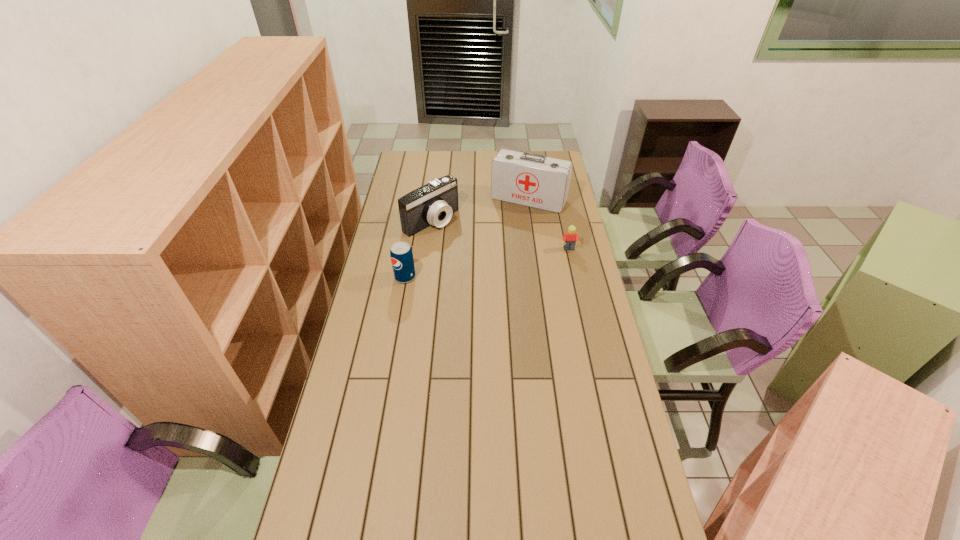
In the image, there is a desktop. Identify the location of vacant region at the right edge. (564, 265).

Identify the location of vacant space at the near right corner of the desktop. The image size is (960, 540). (626, 495).

You are a GUI agent. You are given a task and a screenshot of the screen. Output one action in this format:
    pyautogui.click(x=<x>, y=<y>)
    Task: Click on the free area in between the pop and the third shortest object
    The image size is (960, 540).
    Given the screenshot: What is the action you would take?
    pyautogui.click(x=419, y=249)

At what (x,y) coordinates should I click in order to perform the action: click on free space between the camcorder and the pop. Please return your answer as a coordinate pair (x, y). Looking at the image, I should click on (419, 249).

The height and width of the screenshot is (540, 960). Identify the location of free area in between the third tallest object and the tallest object. (467, 238).

Locate an element on the screen. Image resolution: width=960 pixels, height=540 pixels. free space between the camcorder and the shortest object is located at coordinates (500, 235).

Identify the location of free space between the camcorder and the tallest object. This screenshot has width=960, height=540. (480, 210).

In order to click on unoccupied area between the nearest object and the tallest object in this screenshot , I will do `click(467, 238)`.

Find the location of `vacant area between the shortest object and the third tallest object`. vacant area between the shortest object and the third tallest object is located at coordinates (487, 263).

This screenshot has width=960, height=540. What are the coordinates of `vacant area that lies between the first-aid kit and the Lego` in the screenshot? It's located at [x=549, y=225].